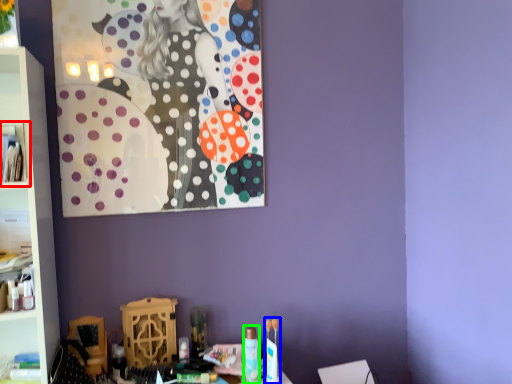
Question: Which object is positioned farthest from cabinet (highlighted by a red box)? Select from toy (highlighted by a blue box) and toiletry (highlighted by a green box).

Choices:
 (A) toy
 (B) toiletry

Answer: (A)